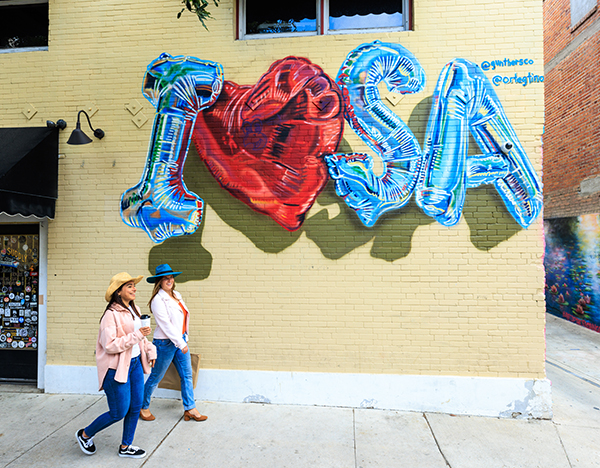
Identify the location of blue bubble letters on beige wall. The image size is (600, 468). pyautogui.click(x=156, y=207), pyautogui.click(x=382, y=165), pyautogui.click(x=446, y=154).